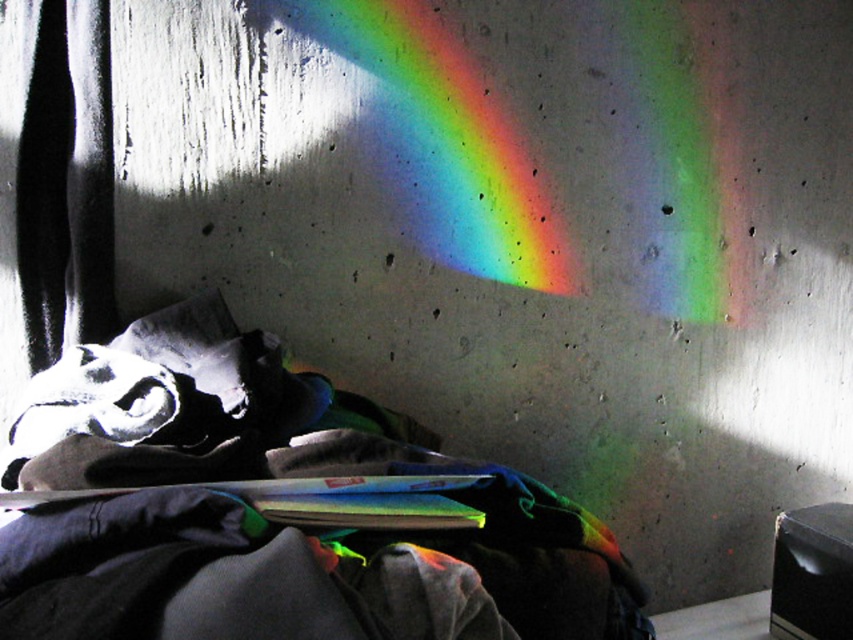
In the scene shown: You are organizing your room and see the dark gray fabric at center and the rainbow spectrum at upper center. Which object is positioned to the right side of the other?

The rainbow spectrum at upper center is positioned to the right side of the dark gray fabric at center.

You are organizing a space and need to place the dark gray fabric at center and the rainbow spectrum at upper center. Given their sizes, which object requires more horizontal space?

The rainbow spectrum at upper center requires more horizontal space because its width is greater than the dark gray fabric at center.

You are standing in a room where sunlight creates a rainbow on the wall. You see a point marked at coordinates (265, 509). What is located at that point?

The point at (265, 509) marks the location of the dark gray fabric at center.